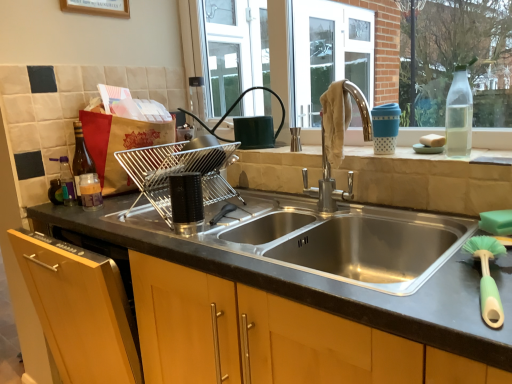
Find the location of a particular element. free space that is in between metallic silver dish rack at sink, the 2th appliance positioned from the front, and black plastic dish rack at center, arranged as the first appliance when viewed from the front is located at coordinates (217, 220).